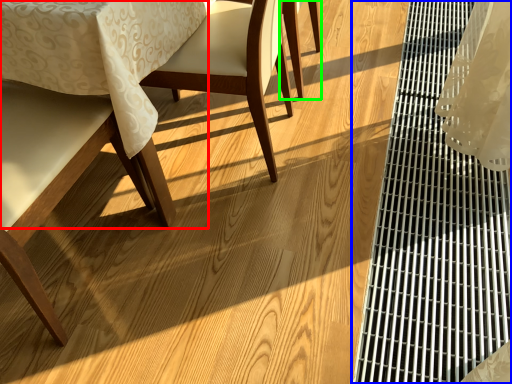
Question: Which is farther away from chair (highlighted by a red box)? table (highlighted by a blue box) or chair (highlighted by a green box)?

Choices:
 (A) table
 (B) chair

Answer: (A)